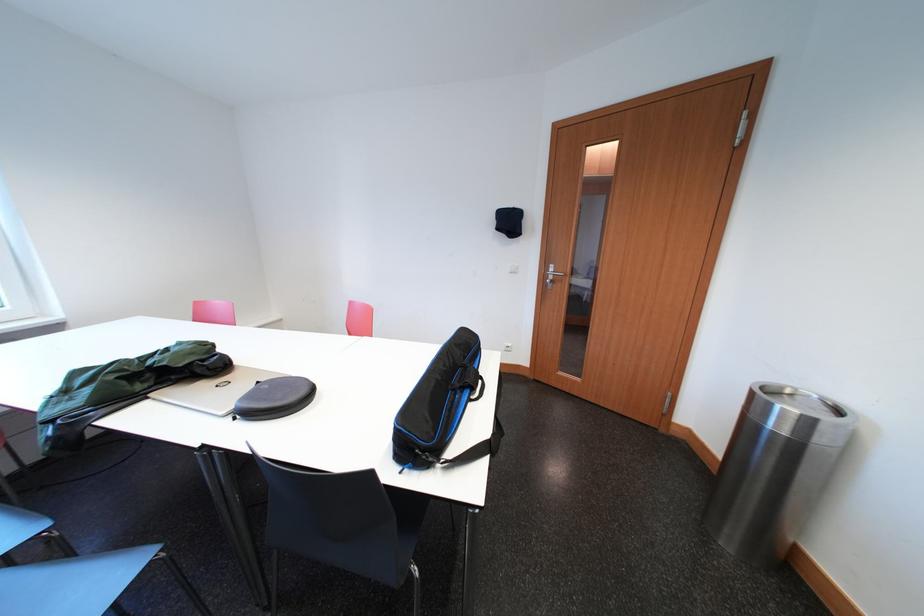
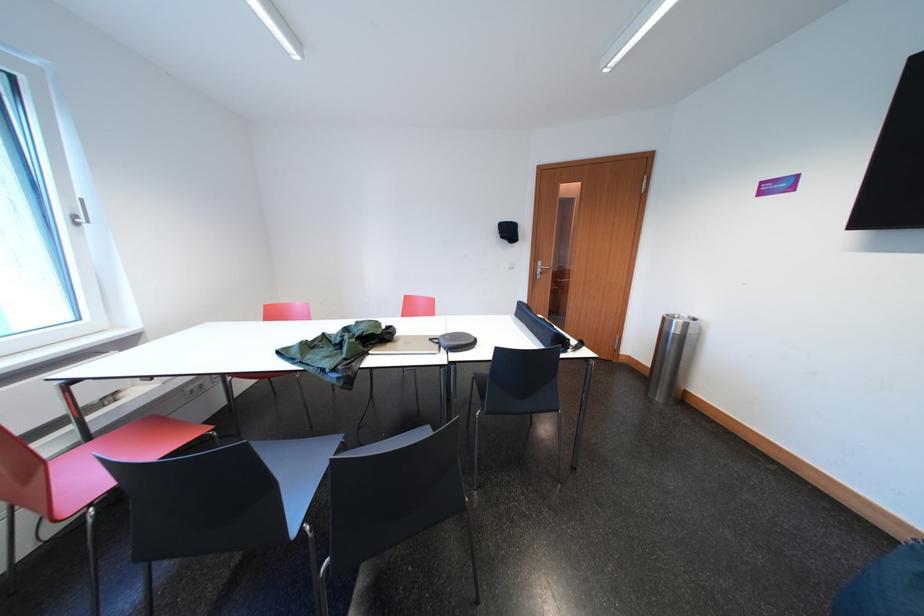
Locate, in the second image, the point that corresponds to [188,347] in the first image.

(367, 326)